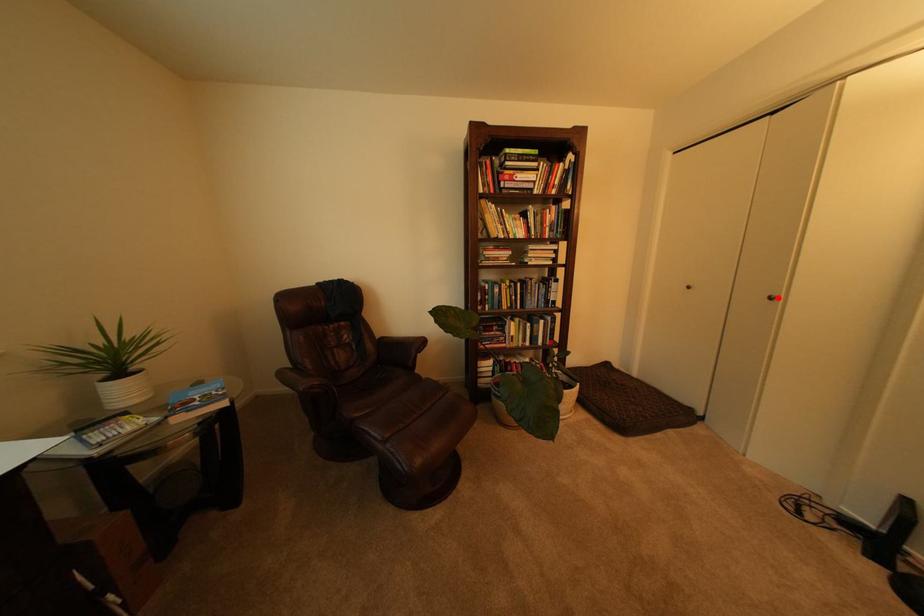
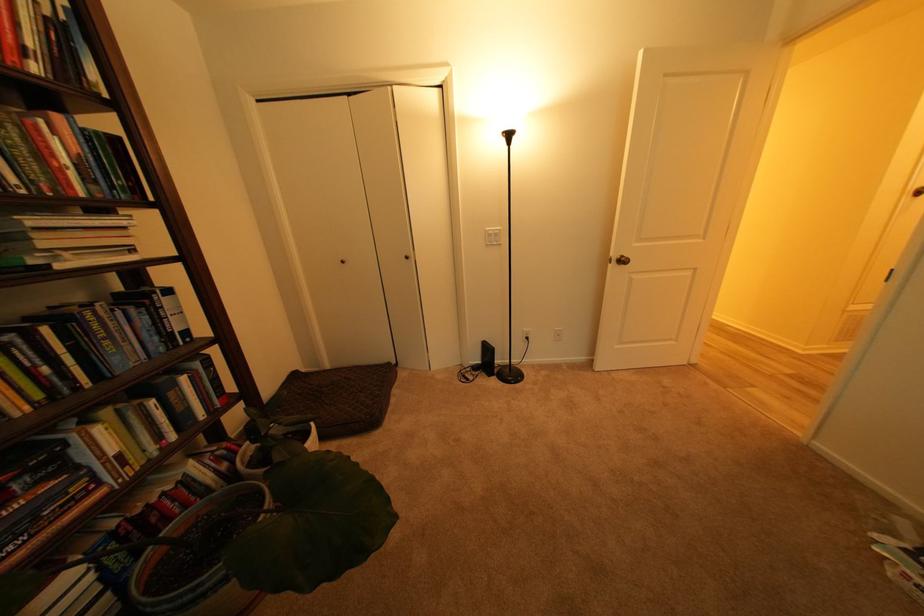
The point at the highlighted location is marked in the first image. Where is the corresponding point in the second image?

(416, 257)